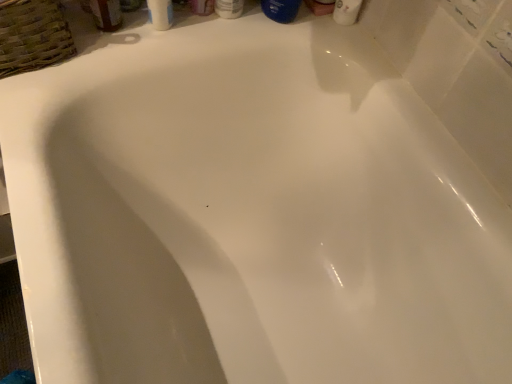
Question: Does white glossy bottle at upper center, the second toiletry from the left, have a greater width compared to matte plastic bottle at upper center, the second toiletry from the right?

Choices:
 (A) no
 (B) yes

Answer: (B)

Question: Considering the relative sizes of white glossy bottle at upper center, the second toiletry from the left, and matte plastic bottle at upper center, the first toiletry when ordered from left to right, in the image provided, is white glossy bottle at upper center, the second toiletry from the left, thinner than matte plastic bottle at upper center, the first toiletry when ordered from left to right,?

Choices:
 (A) no
 (B) yes

Answer: (A)

Question: Is white glossy bottle at upper center, the 1th toiletry in the right-to-left sequence, placed right next to matte plastic bottle at upper center, the first toiletry when ordered from left to right?

Choices:
 (A) no
 (B) yes

Answer: (B)

Question: Is white glossy bottle at upper center, the 1th toiletry in the right-to-left sequence, completely or partially outside of matte plastic bottle at upper center, the first toiletry when ordered from left to right?

Choices:
 (A) no
 (B) yes

Answer: (B)

Question: Is white glossy bottle at upper center, the second toiletry from the left, positioned behind matte plastic bottle at upper center, the first toiletry when ordered from left to right?

Choices:
 (A) yes
 (B) no

Answer: (A)

Question: In the image, is woven brown basket at upper left positioned in front of or behind white glossy bottle at upper center, the 1th toiletry in the right-to-left sequence?

Choices:
 (A) front
 (B) behind

Answer: (A)

Question: From a real-world perspective, relative to white glossy bottle at upper center, the 1th toiletry in the right-to-left sequence, is woven brown basket at upper left vertically above or below?

Choices:
 (A) above
 (B) below

Answer: (B)

Question: Considering the relative positions of woven brown basket at upper left and white glossy bottle at upper center, the 1th toiletry in the right-to-left sequence, in the image provided, is woven brown basket at upper left to the left or to the right of white glossy bottle at upper center, the 1th toiletry in the right-to-left sequence,?

Choices:
 (A) left
 (B) right

Answer: (A)

Question: Based on their sizes in the image, would you say woven brown basket at upper left is bigger or smaller than white glossy bottle at upper center, the 1th toiletry in the right-to-left sequence?

Choices:
 (A) big
 (B) small

Answer: (A)

Question: Is matte plastic bottle at upper center, the first toiletry when ordered from left to right, in front of or behind white glossy bottle at upper center, the 1th toiletry in the right-to-left sequence, in the image?

Choices:
 (A) front
 (B) behind

Answer: (A)

Question: Visually, is matte plastic bottle at upper center, the second toiletry from the right, positioned to the left or to the right of white glossy bottle at upper center, the 1th toiletry in the right-to-left sequence?

Choices:
 (A) left
 (B) right

Answer: (A)

Question: In terms of height, does matte plastic bottle at upper center, the first toiletry when ordered from left to right, look taller or shorter compared to white glossy bottle at upper center, the second toiletry from the left?

Choices:
 (A) short
 (B) tall

Answer: (B)

Question: Based on their sizes in the image, would you say matte plastic bottle at upper center, the second toiletry from the right, is bigger or smaller than white glossy bottle at upper center, the second toiletry from the left?

Choices:
 (A) big
 (B) small

Answer: (B)

Question: From a real-world perspective, relative to woven brown basket at upper left, is blue glossy bottle at upper center, placed as the first mouthwash when sorted from right to left, vertically above or below?

Choices:
 (A) above
 (B) below

Answer: (A)

Question: Considering their positions, is blue glossy bottle at upper center, the second mouthwash in the left-to-right sequence, located in front of or behind woven brown basket at upper left?

Choices:
 (A) front
 (B) behind

Answer: (B)